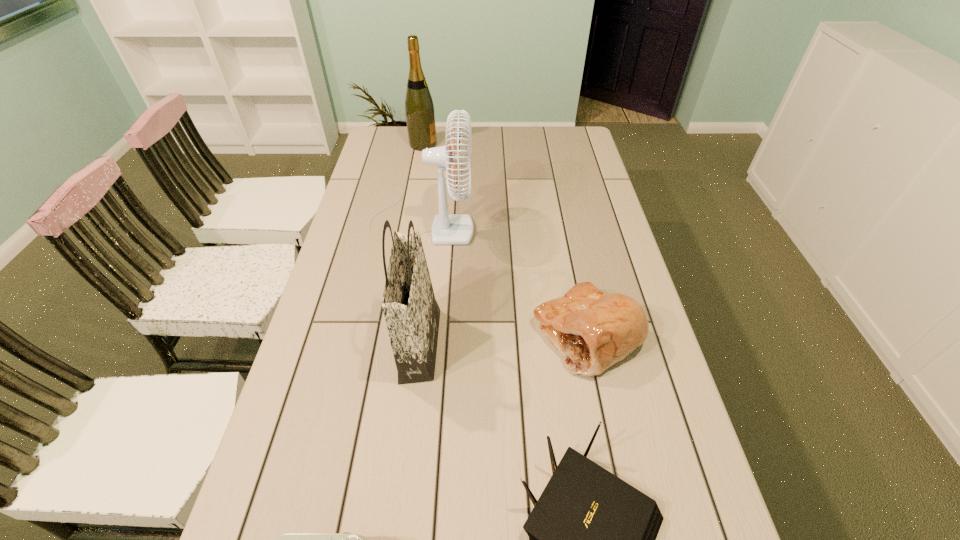
Where is `object that is at the far edge`? This screenshot has width=960, height=540. object that is at the far edge is located at coordinates (419, 109).

The width and height of the screenshot is (960, 540). Identify the location of wine bottle present at the left edge. (419, 109).

Locate an element on the screen. This screenshot has height=540, width=960. fan that is positioned at the left edge is located at coordinates coord(447,229).

Where is `object present at the right edge`? object present at the right edge is located at coordinates (592, 330).

You are a GUI agent. You are given a task and a screenshot of the screen. Output one action in this format:
    pyautogui.click(x=<x>, y=<y>)
    Task: Click on the object that is at the far left corner
    The height and width of the screenshot is (540, 960).
    Given the screenshot: What is the action you would take?
    pyautogui.click(x=419, y=109)

In the image, there is a desktop. In order to click on vacant area at the far edge in this screenshot , I will do `click(471, 151)`.

I want to click on vacant space at the left edge of the desktop, so click(x=399, y=161).

In the image, there is a desktop. At what (x,y) coordinates should I click in order to perform the action: click on free region at the right edge. Please return your answer as a coordinate pair (x, y). The image size is (960, 540). Looking at the image, I should click on (624, 247).

You are a GUI agent. You are given a task and a screenshot of the screen. Output one action in this format:
    pyautogui.click(x=<x>, y=<y>)
    Task: Click on the free space between the fan and the farthest object
    This screenshot has height=540, width=960.
    Given the screenshot: What is the action you would take?
    pyautogui.click(x=422, y=182)

The image size is (960, 540). Find the location of `object that ranks as the closest to the shopping bag`. object that ranks as the closest to the shopping bag is located at coordinates (447, 229).